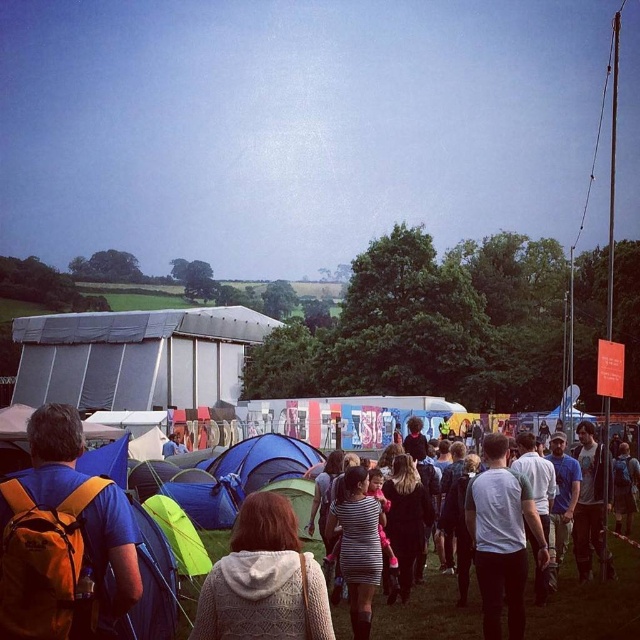
Measure the distance between knitted beige sweater at center and camera.

knitted beige sweater at center is 25.48 meters from camera.

Is knitted beige sweater at center smaller than striped fabric dress at center?

Incorrect, knitted beige sweater at center is not smaller in size than striped fabric dress at center.

Between point (227, 589) and point (355, 531), which one is positioned behind?

Positioned behind is point (355, 531).

What are the coordinates of `knitted beige sweater at center` in the screenshot? It's located at (262, 580).

Does orange backpack at lower left appear on the right side of knitted beige sweater at center?

In fact, orange backpack at lower left is to the left of knitted beige sweater at center.

Is point (90, 625) farther from viewer compared to point (310, 568)?

That is False.

Who is more forward, (132, 536) or (212, 572)?

Point (132, 536) is more forward.

At what (x,y) coordinates should I click in order to perform the action: click on orange backpack at lower left. Please return your answer as a coordinate pair (x, y). Image resolution: width=640 pixels, height=640 pixels. Looking at the image, I should click on pyautogui.click(x=60, y=536).

Does knitted beige sweater at center come behind white cotton shirt at center?

No, it is in front of white cotton shirt at center.

Is point (230, 586) in front of point (516, 600)?

Yes, it is.

This screenshot has width=640, height=640. What do you see at coordinates (262, 580) in the screenshot?
I see `knitted beige sweater at center` at bounding box center [262, 580].

I want to click on knitted beige sweater at center, so click(x=262, y=580).